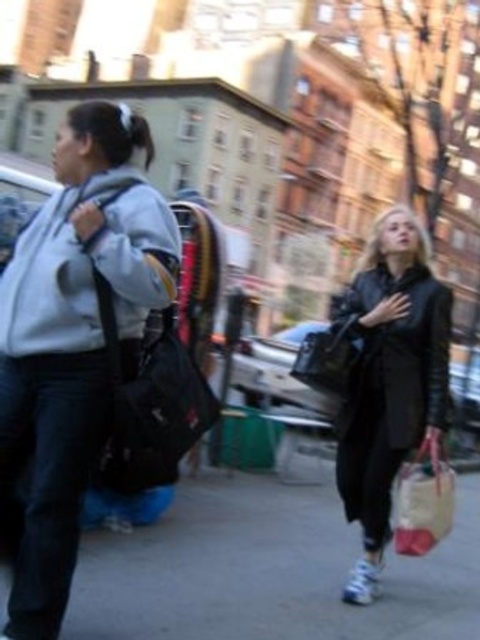
Does point (399, 355) lie behind point (416, 516)?

Yes, point (399, 355) is farther from viewer.

Is point (408, 376) more distant than point (415, 538)?

That is True.

The width and height of the screenshot is (480, 640). What are the coordinates of `black leather coat at right` in the screenshot? It's located at (389, 380).

How far apart are gray concrete pavement at lower center and shiny black handbag at center?

They are 5.89 feet apart.

Is gray concrete pavement at lower center behind shiny black handbag at center?

No, it is in front of shiny black handbag at center.

Which is behind, point (84, 579) or point (347, 381)?

Point (347, 381)

Where is `gray concrete pavement at lower center`? The height and width of the screenshot is (640, 480). gray concrete pavement at lower center is located at coordinates (267, 570).

Can you confirm if black leather coat at right is shorter than matte gray sweatshirt at left?

In fact, black leather coat at right may be taller than matte gray sweatshirt at left.

Which is behind, point (383, 460) or point (148, 205)?

The point (383, 460) is behind.

What do you see at coordinates (389, 380) in the screenshot?
I see `black leather coat at right` at bounding box center [389, 380].

Image resolution: width=480 pixels, height=640 pixels. Find the location of `black leather coat at right`. black leather coat at right is located at coordinates (389, 380).